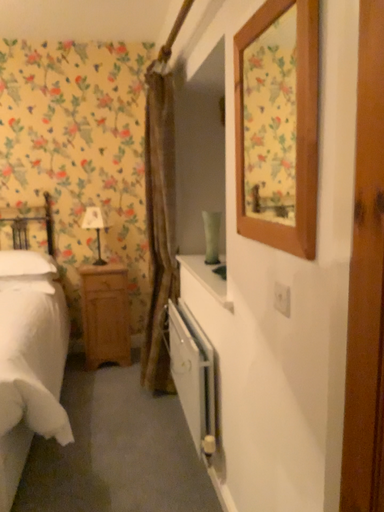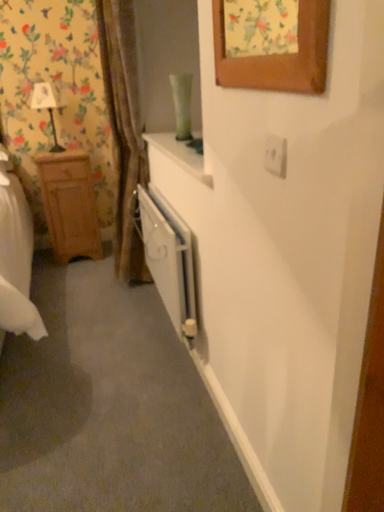
Question: Which way did the camera rotate in the video?

Choices:
 (A) rotated downward
 (B) rotated upward

Answer: (A)